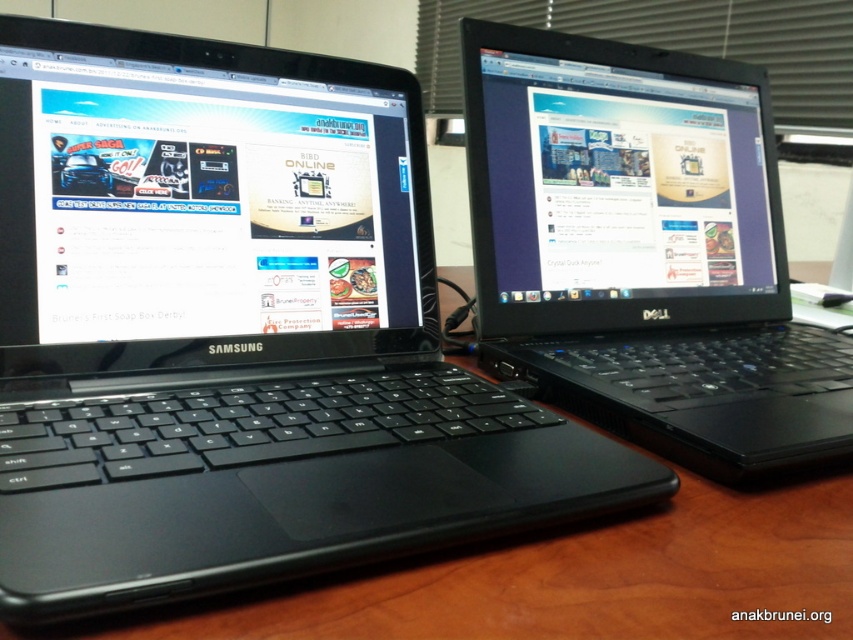
Is matte black laptop at left thinner than black plastic laptop at center?

Correct, matte black laptop at left's width is less than black plastic laptop at center's.

Does point (283, 308) come in front of point (685, 300)?

Yes, point (283, 308) is closer to viewer.

Locate an element on the screen. Image resolution: width=853 pixels, height=640 pixels. matte black laptop at left is located at coordinates pyautogui.click(x=204, y=204).

Is black plastic laptop at center to the left of matte black screen at upper center from the viewer's perspective?

Correct, you'll find black plastic laptop at center to the left of matte black screen at upper center.

Is point (502, 93) more distant than point (550, 10)?

No, it is in front of (550, 10).

Identify the location of black plastic laptop at center. (643, 250).

In the scene shown: Does matte black laptop at left have a greater height compared to matte black screen at upper center?

In fact, matte black laptop at left may be shorter than matte black screen at upper center.

Is point (200, 358) closer to viewer compared to point (585, 29)?

Yes, it is.

Where is `matte black laptop at left`? matte black laptop at left is located at coordinates (204, 204).